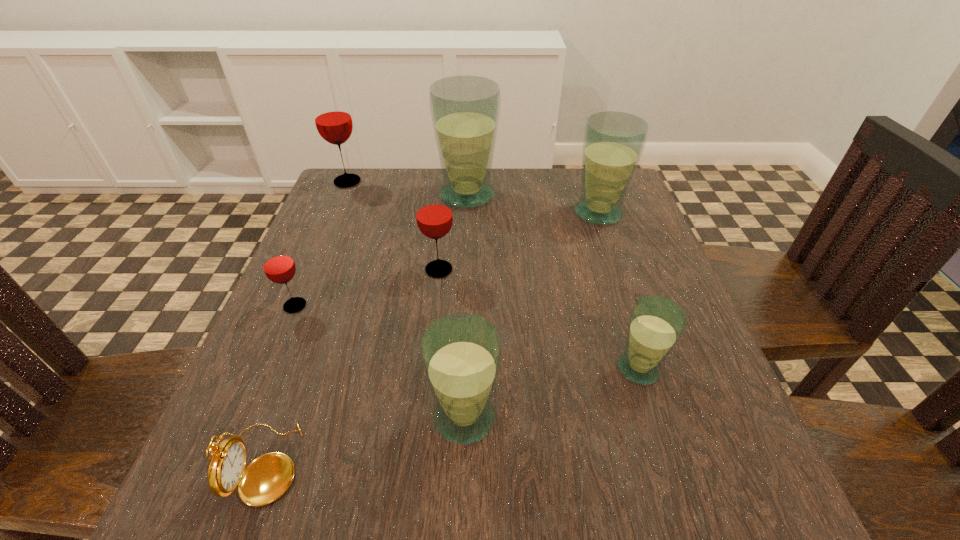
In the image, there is a desktop. At what (x,y) coordinates should I click in order to perform the action: click on vacant area at the far right corner. Please return your answer as a coordinate pair (x, y). The width and height of the screenshot is (960, 540). Looking at the image, I should click on (579, 180).

The image size is (960, 540). In order to click on vacant region between the fifth nearest object and the tallest glass in this screenshot , I will do `click(453, 232)`.

Locate an element on the screen. The image size is (960, 540). free space between the farthest red glass and the second smallest blue glass is located at coordinates (406, 300).

Identify the location of free area in between the fifth farthest glass and the biggest red glass. (322, 244).

Locate an element on the screen. The height and width of the screenshot is (540, 960). unoccupied position between the nearest red glass and the fourth farthest glass is located at coordinates coord(367,288).

This screenshot has width=960, height=540. In order to click on free space between the third smallest blue glass and the smallest blue glass in this screenshot , I will do `click(618, 291)`.

You are a GUI agent. You are given a task and a screenshot of the screen. Output one action in this format:
    pyautogui.click(x=<x>, y=<y>)
    Task: Click on the vacant point located between the smallest red glass and the tallest object
    The image size is (960, 540).
    Given the screenshot: What is the action you would take?
    pyautogui.click(x=381, y=251)

Identify the location of vacant space that's between the third nearest glass and the pocket watch. This screenshot has height=540, width=960. (280, 384).

At what (x,y) coordinates should I click in order to perform the action: click on vacant space that is in between the smallest red glass and the third smallest blue glass. Please return your answer as a coordinate pair (x, y). Looking at the image, I should click on (446, 259).

At what (x,y) coordinates should I click in order to perform the action: click on object that stands as the third closest to the smallest blue glass. Please return your answer as a coordinate pair (x, y). Looking at the image, I should click on (613, 142).